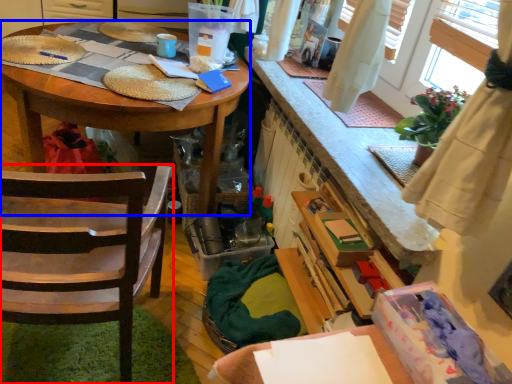
Question: Which object is further to the camera taking this photo, chair (highlighted by a red box) or desk (highlighted by a blue box)?

Choices:
 (A) chair
 (B) desk

Answer: (B)